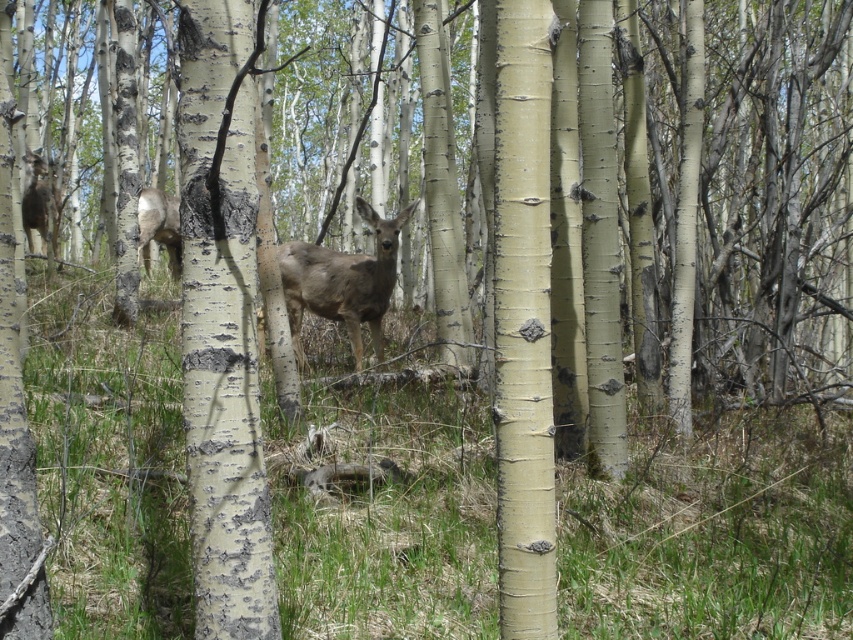
You are an animal researcher observing two deer in the forest. You notice the brown fur deer at center and the brown fur deer at left. Which deer is shorter in height?

The brown fur deer at center is shorter than the brown fur deer at left.

You are an animal tracker trying to locate the brown fur deer at center in the forest. According to the coordinates provided, where exactly is the deer positioned in the image?

The brown fur deer at center is located at the 2D coordinates point (341, 282) in the image.